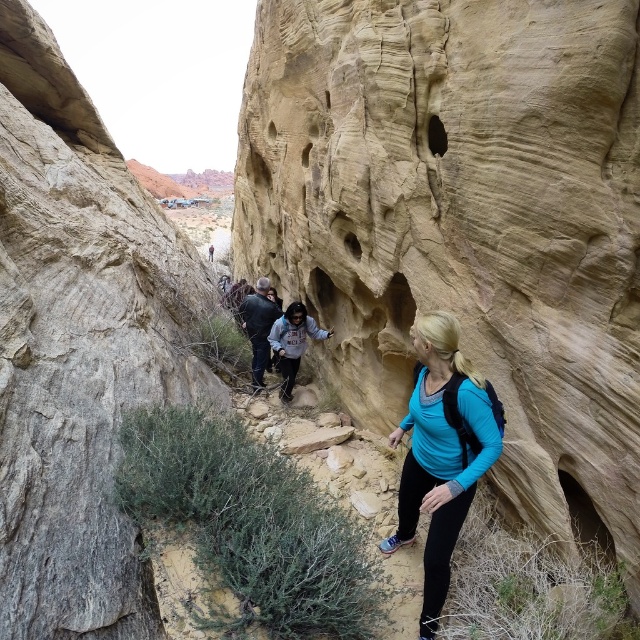
Who is higher up, gray textured rock at left or blue fabric backpack at center?

gray textured rock at left

Which is in front, point (24, 492) or point (444, 515)?

Point (24, 492) is in front.

Who is more forward, (61, 195) or (461, 506)?

Point (461, 506) is in front.

Where is `gray textured rock at left`? Image resolution: width=640 pixels, height=640 pixels. gray textured rock at left is located at coordinates (77, 348).

Does smooth sandstone rock face at center have a smaller size compared to blue fabric backpack at center?

No.

Does smooth sandstone rock face at center have a lesser width compared to blue fabric backpack at center?

Incorrect, smooth sandstone rock face at center's width is not less than blue fabric backpack at center's.

The width and height of the screenshot is (640, 640). Identify the location of smooth sandstone rock face at center. (464, 221).

Which of these two, gray textured rock at left or dark blue jeans at center, stands taller?

Standing taller between the two is gray textured rock at left.

Consider the image. Can you confirm if gray textured rock at left is positioned to the right of dark blue jeans at center?

In fact, gray textured rock at left is to the left of dark blue jeans at center.

Locate an element on the screen. The height and width of the screenshot is (640, 640). gray textured rock at left is located at coordinates (77, 348).